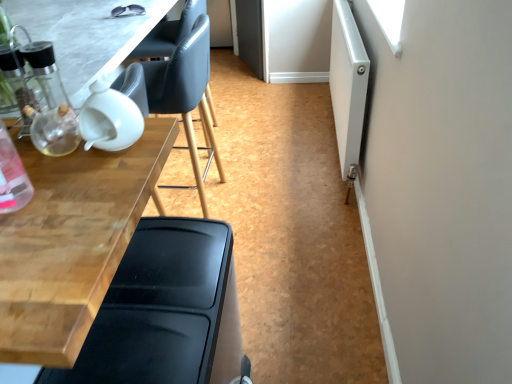
The image size is (512, 384). I want to click on unoccupied space behind white matte screen door at right, so click(296, 108).